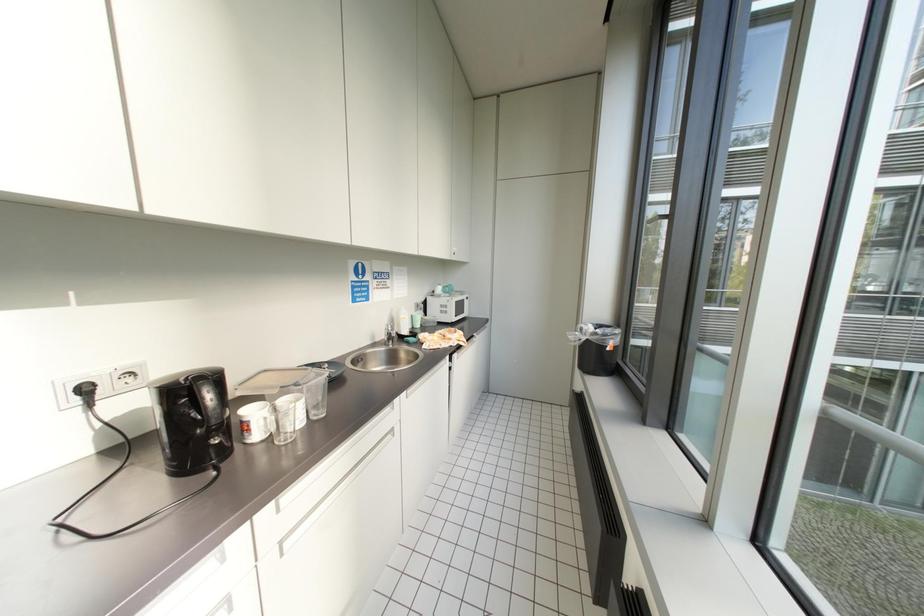
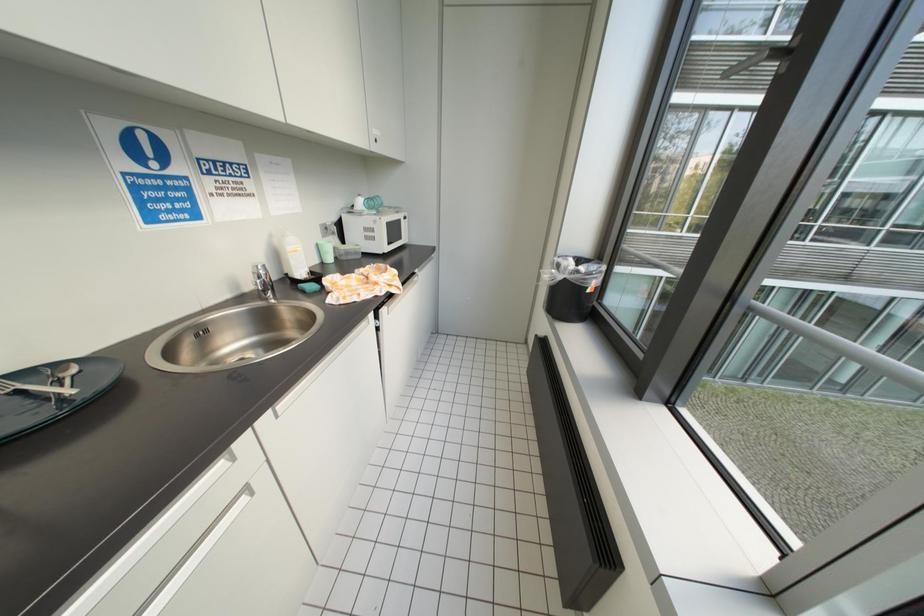
Question: The first image is from the beginning of the video and the second image is from the end. How did the camera likely rotate when shooting the video?

Choices:
 (A) Left
 (B) Right
 (C) Up
 (D) Down

Answer: (D)